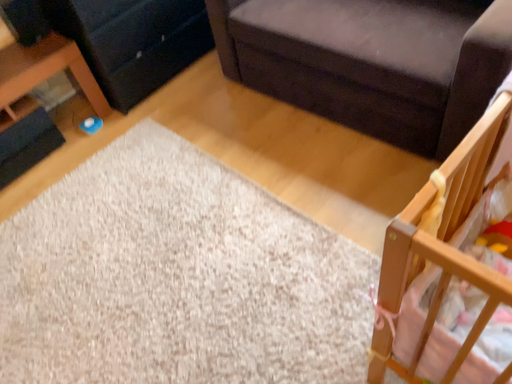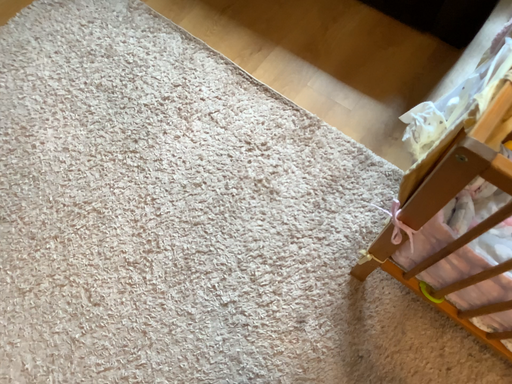
Question: How did the camera likely rotate when shooting the video?

Choices:
 (A) rotated left
 (B) rotated right

Answer: (B)